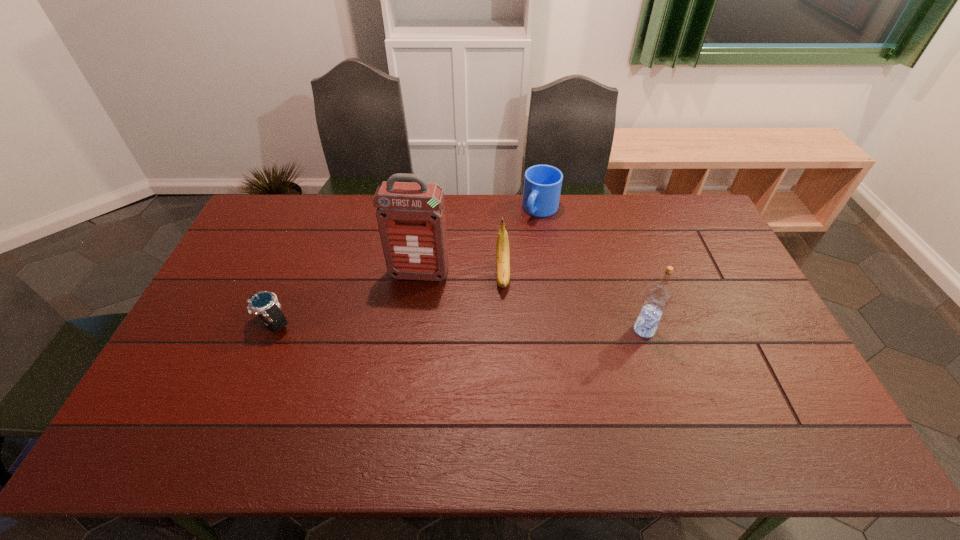
Where is `watch`? The height and width of the screenshot is (540, 960). watch is located at coordinates coord(265,304).

Where is `the shortest object`? Image resolution: width=960 pixels, height=540 pixels. the shortest object is located at coordinates (265, 304).

What are the coordinates of `the fourth shortest object` in the screenshot? It's located at (657, 298).

Locate an element on the screen. vodka is located at coordinates (657, 298).

This screenshot has height=540, width=960. I want to click on the second shortest object, so click(x=542, y=183).

The height and width of the screenshot is (540, 960). In order to click on the fourth object from left to right in this screenshot , I will do `click(542, 183)`.

Identify the location of the third object from right to left. (502, 245).

This screenshot has height=540, width=960. What are the coordinates of `banana` in the screenshot? It's located at (502, 245).

The height and width of the screenshot is (540, 960). Identify the location of the first-aid kit. (x=411, y=216).

Find the location of a particular element. The image size is (960, 540). the tallest object is located at coordinates (411, 216).